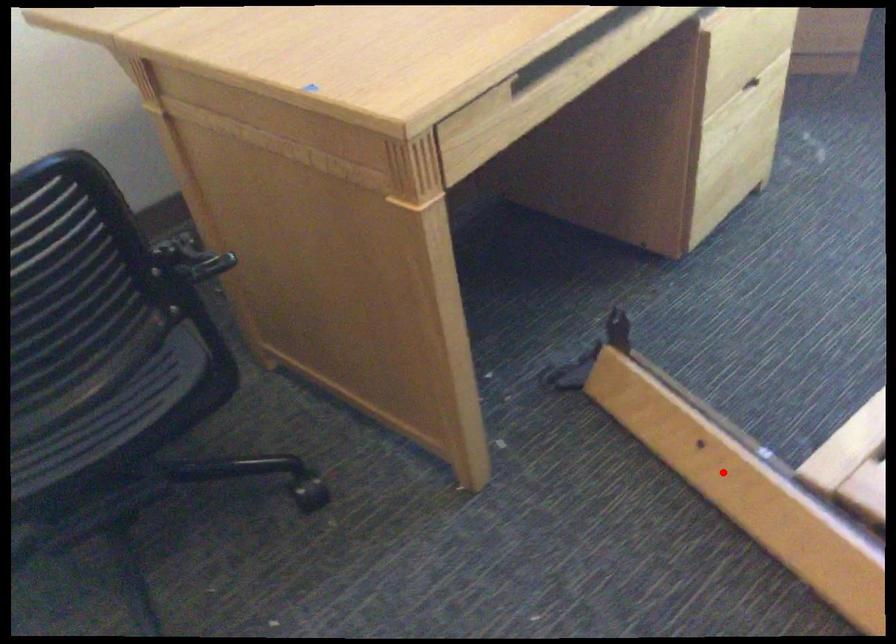
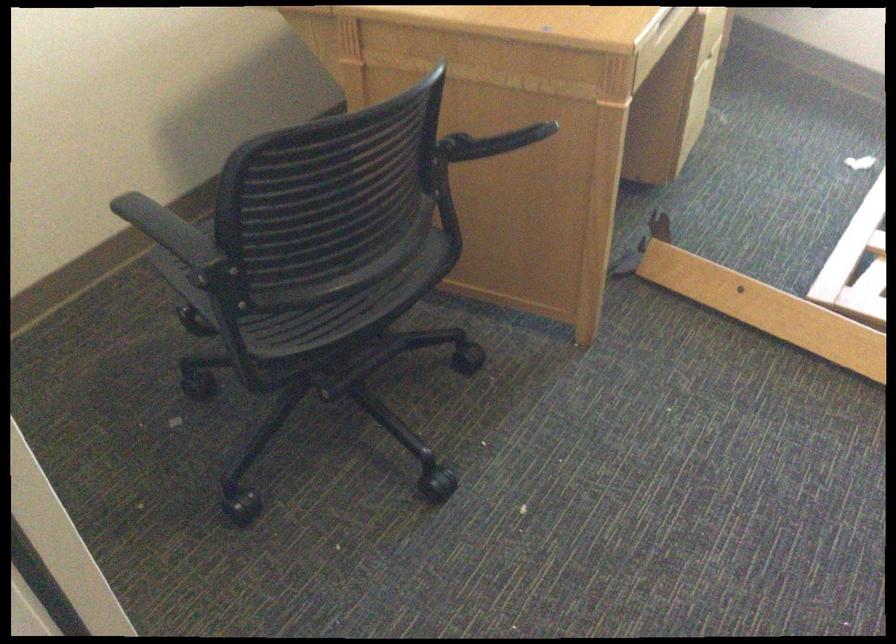
The point at the highlighted location is marked in the first image. Where is the corresponding point in the second image?

(767, 308)